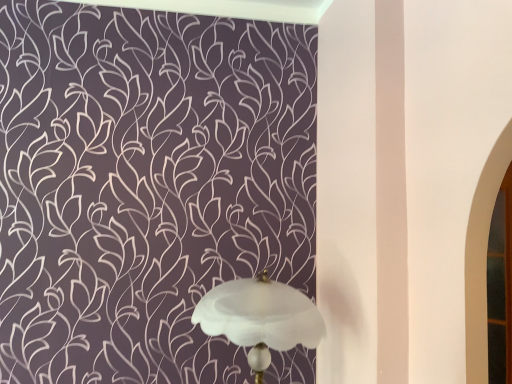
I want to click on white frosted glass lampshade at center, so click(x=260, y=318).

Describe the element at coordinates (260, 318) in the screenshot. This screenshot has width=512, height=384. I see `white frosted glass lampshade at center` at that location.

Find the location of a particular element. Image resolution: width=512 pixels, height=384 pixels. white frosted glass lampshade at center is located at coordinates (260, 318).